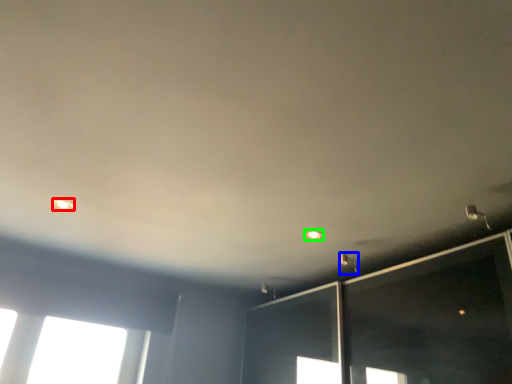
Question: Estimate the real-world distances between objects in this image. Which object is farther from dot (highlighted by a red box), light fixture (highlighted by a blue box) or dot (highlighted by a green box)?

Choices:
 (A) light fixture
 (B) dot

Answer: (A)